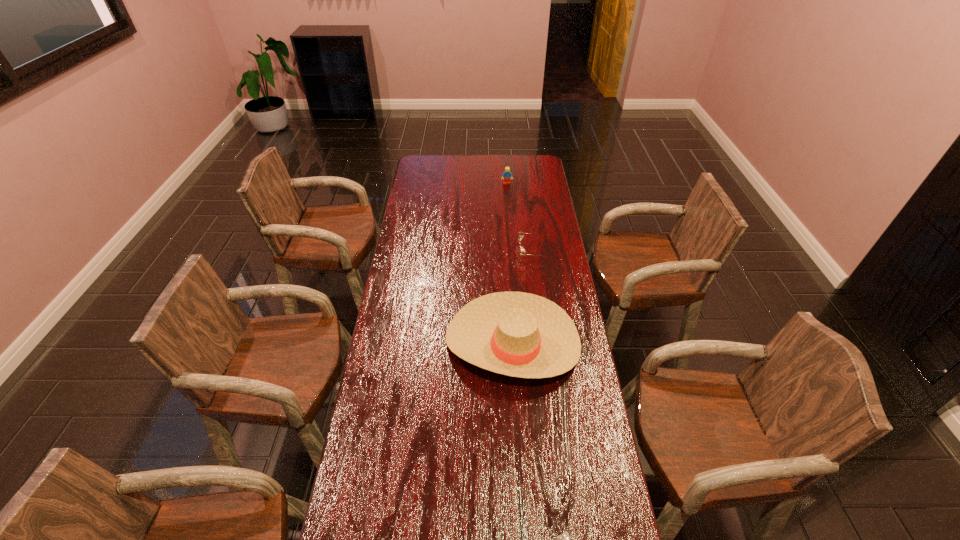
The width and height of the screenshot is (960, 540). Identify the location of the second nearest object. (518, 334).

Locate an element on the screen. the tallest object is located at coordinates (518, 334).

Locate an element on the screen. Image resolution: width=960 pixels, height=540 pixels. the farthest object is located at coordinates (507, 174).

The height and width of the screenshot is (540, 960). I want to click on Lego, so click(507, 174).

Where is `the third tallest object`? The width and height of the screenshot is (960, 540). the third tallest object is located at coordinates (522, 252).

In order to click on the second farthest object in this screenshot , I will do `click(522, 252)`.

At what (x,y) coordinates should I click in order to perform the action: click on blank space located 0.070m on the back of the tallest object. Please return your answer as a coordinate pair (x, y). Looking at the image, I should click on [509, 289].

The image size is (960, 540). I want to click on vacant point located 0.060m on the face of the farthest object, so click(x=508, y=191).

Locate an element on the screen. This screenshot has width=960, height=540. vacant space located on the front lenses of the third nearest object is located at coordinates (505, 252).

I want to click on vacant space located on the front lenses of the third nearest object, so click(428, 252).